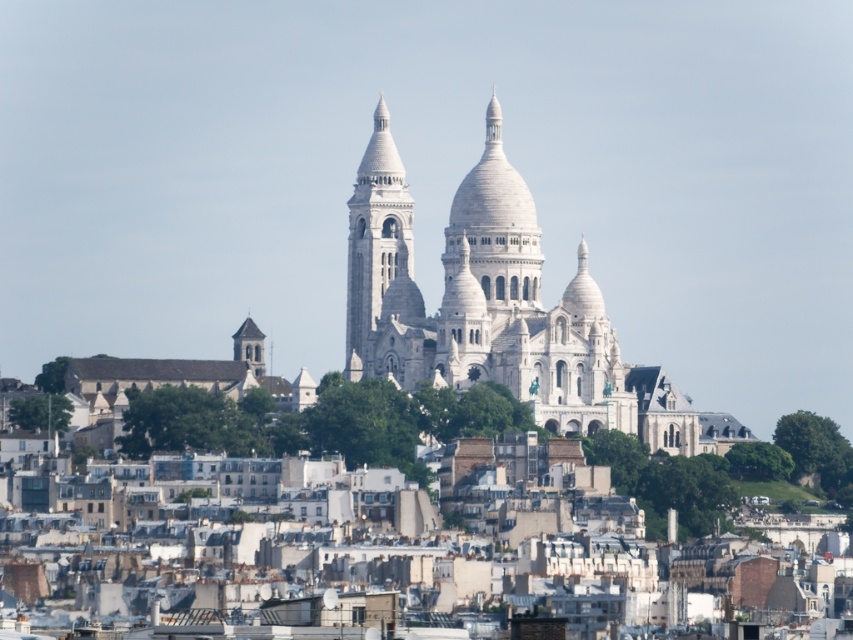
You are standing at the base of the smooth gray stone tower at lower left and want to walk towards the white stone tower at center. In which direction should you head?

You should head to the right to reach the white stone tower at center since it is located to the right of the smooth gray stone tower at lower left.

You are a tourist standing at the base of the white stone tower at center and want to take a photo of the smooth gray stone tower at lower left. Which tower should you look towards, up or down?

The white stone tower at center is above the smooth gray stone tower at lower left, so you should look downward to capture the smooth gray stone tower at lower left in your photo.

You are an architect analyzing the cityscape. You need to determine which tower is taller between the white stone tower at center and the smooth gray stone tower at lower left. Based on the scene, which one is taller?

The white stone tower at center is taller than the smooth gray stone tower at lower left according to the description.